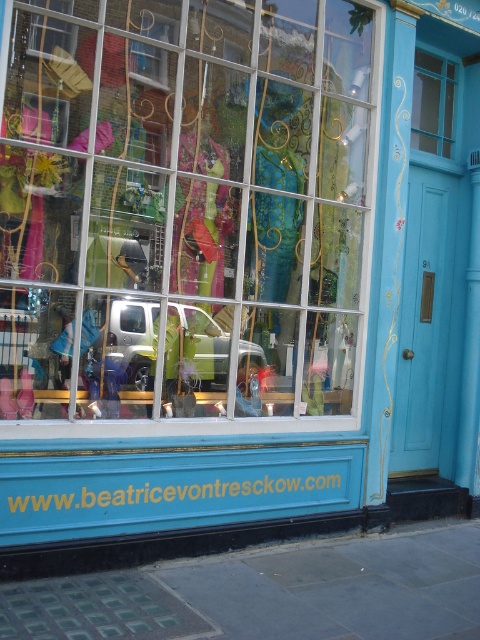
Question: Which object is positioned closest to the metallic silver car at center?

Choices:
 (A) teal fabric dress at center
 (B) clear glass window at upper center
 (C) transparent glass window at upper right
 (D) matte glass window at center

Answer: (D)

Question: Does metallic silver car at center have a smaller size compared to transparent glass window at upper right?

Choices:
 (A) no
 (B) yes

Answer: (A)

Question: Is matte glass window at center bigger than teal fabric dress at center?

Choices:
 (A) yes
 (B) no

Answer: (A)

Question: Which of the following is the farthest from the observer?

Choices:
 (A) clear glass window at upper center
 (B) matte glass window at center
 (C) transparent glass window at upper right
 (D) metallic silver car at center

Answer: (C)

Question: Is matte glass window at center thinner than clear glass window at upper center?

Choices:
 (A) no
 (B) yes

Answer: (A)

Question: Which object appears farthest from the camera in this image?

Choices:
 (A) teal fabric dress at center
 (B) transparent glass window at upper right
 (C) matte glass window at center

Answer: (B)